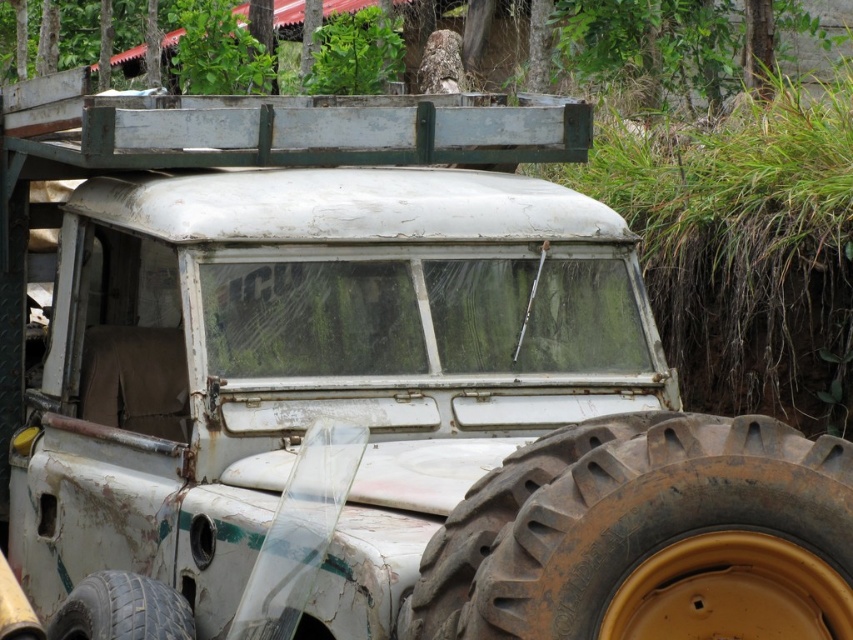
You are standing 3 meters away from the vehicle. Can you reach the point at coordinates point (503, 540) on the vehicle without moving closer?

The distance of point (503, 540) from camera is 3.47 meters. Since you are standing 3 meters away from the vehicle, you are 0.47 meters away from the point. Therefore, you can reach the point without moving closer.

You are standing at the origin point of the coordinate system where the lower left corner of the image is the origin. The image has a coordinate system where the x and y axes increase to the right and up respectively. You need to locate the rusty rubber tire at lower right. What are its coordinates?

The coordinates of the rusty rubber tire at lower right are at point (648, 536).

You are a mechanic inspecting the vehicle and need to replace the tires. Which tire is positioned to the right side of the vehicle, the rusty rubber tire at lower right or the dark brown rubber tire at lower left?

The rusty rubber tire at lower right is positioned to the right of the dark brown rubber tire at lower left.